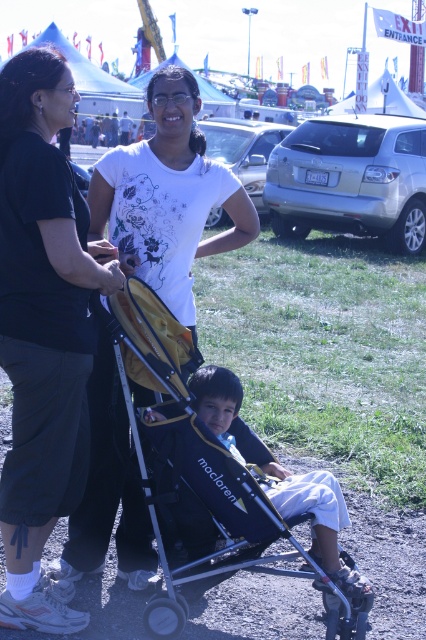
You are a photographer standing at the back of the fairground. You want to take a photo of the black fabric shirt at center and the yellow fabric stroller at center without any obstruction. Given that your camera can focus on objects within a 30 inch range, will you be able to capture both subjects in the same frame?

The black fabric shirt at center and yellow fabric stroller at center are 29.57 inches apart, so yes, your camera can focus on both subjects within the 30 inch range and capture them in the same frame.

You are a photographer at the fair and want to capture both the black cotton shirt at upper left and the black fabric shirt at center in a single photo. Based on their positions, which shirt should you focus on first to ensure both are in frame?

The black cotton shirt at upper left is located below the black fabric shirt at center, so you should focus on the black fabric shirt at center first to ensure both are in frame.

You are standing at the point marked as point (31, 51) in the image. You want to walk towards the fairground entrance located 20 feet behind you. How far will you have to walk in total to reach the entrance?

You are currently at point (31, 51), which is 10.61 feet away from the viewer. To reach the entrance 20 feet behind you, you must walk 10.61 feet to return to the viewer and then an additional 20 feet to the entrance, totaling 30.61 feet.